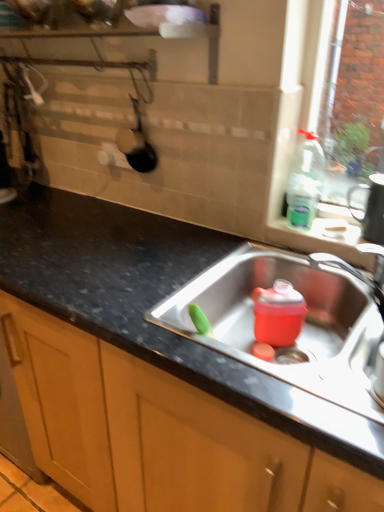
This screenshot has height=512, width=384. Describe the element at coordinates (302, 327) in the screenshot. I see `stainless steel sink at center` at that location.

Image resolution: width=384 pixels, height=512 pixels. Describe the element at coordinates (360, 272) in the screenshot. I see `metallic silver tap at right` at that location.

What do you see at coordinates (154, 304) in the screenshot? This screenshot has width=384, height=512. I see `black granite countertop at center` at bounding box center [154, 304].

The image size is (384, 512). What are the coordinates of `stainless steel sink at center` in the screenshot? It's located at (302, 327).

Considering the sizes of objects stainless steel sink at center and black granite countertop at center in the image provided, who is bigger, stainless steel sink at center or black granite countertop at center?

Bigger between the two is black granite countertop at center.

Considering the positions of points (308, 287) and (343, 441), is point (308, 287) farther from camera compared to point (343, 441)?

Yes, point (308, 287) is behind point (343, 441).

Measure the distance from stainless steel sink at center to black granite countertop at center.

They are 8.75 inches apart.

From a real-world perspective, is stainless steel sink at center positioned above or below black granite countertop at center?

In terms of real-world spatial position, stainless steel sink at center is above black granite countertop at center.

Looking at this image, considering the positions of objects black granite countertop at center and metallic silver tap at right in the image provided, who is more to the left, black granite countertop at center or metallic silver tap at right?

black granite countertop at center.

Could you tell me if black granite countertop at center is turned towards metallic silver tap at right?

No, black granite countertop at center is not aimed at metallic silver tap at right.

Considering the positions of points (124, 341) and (358, 276), is point (124, 341) farther from camera compared to point (358, 276)?

That is False.

Is black granite countertop at center in front of or behind metallic silver tap at right in the image?

black granite countertop at center is positioned closer to the viewer than metallic silver tap at right.

Is black granite countertop at center placed right next to black matte mug at upper right?

black granite countertop at center is not next to black matte mug at upper right, and they're not touching.

From a real-world perspective, is black granite countertop at center positioned under black matte mug at upper right based on gravity?

Yes, from a real-world perspective, black granite countertop at center is below black matte mug at upper right.

Visually, is black granite countertop at center positioned to the left or to the right of black matte mug at upper right?

black granite countertop at center is positioned on black matte mug at upper right's left side.

Looking at the image, does stainless steel sink at center seem bigger or smaller compared to black matte mug at upper right?

Clearly, stainless steel sink at center is larger in size than black matte mug at upper right.

Can you tell me how much stainless steel sink at center and black matte mug at upper right differ in facing direction?

They differ by 0.811 degrees in their facing directions.

Consider the image. Would you say stainless steel sink at center is a long distance from black matte mug at upper right?

They are positioned close to each other.

Which of these two, stainless steel sink at center or black matte mug at upper right, stands shorter?

With less height is stainless steel sink at center.

Looking at this image, does metallic silver tap at right have a lesser width compared to black matte mug at upper right?

Incorrect, the width of metallic silver tap at right is not less than that of black matte mug at upper right.

From the image's perspective, relative to black matte mug at upper right, is metallic silver tap at right above or below?

metallic silver tap at right is below black matte mug at upper right.

Which is behind, point (334, 261) or point (370, 209)?

Point (334, 261)

The height and width of the screenshot is (512, 384). Find the location of `tap on the right of stainless steel sink at center`. tap on the right of stainless steel sink at center is located at coordinates (360, 272).

Looking at this image, relative to stainless steel sink at center, is metallic silver tap at right in front or behind?

Clearly, metallic silver tap at right is behind stainless steel sink at center.

Does point (370, 253) appear closer or farther from the camera than point (353, 345)?

Point (370, 253).

Find the location of `countertop in front of the metallic silver tap at right`. countertop in front of the metallic silver tap at right is located at coordinates (154, 304).

From the picture: Does metallic silver tap at right contain black granite countertop at center?

No, black granite countertop at center is not a part of metallic silver tap at right.

What's the angular difference between metallic silver tap at right and black granite countertop at center's facing directions?

28.4 degrees separate the facing orientations of metallic silver tap at right and black granite countertop at center.

From a real-world perspective, is metallic silver tap at right positioned over black granite countertop at center based on gravity?

Correct, in the physical world, metallic silver tap at right is higher than black granite countertop at center.

Image resolution: width=384 pixels, height=512 pixels. I want to click on countertop in front of the stainless steel sink at center, so click(x=154, y=304).

Locate an element on the screen. Image resolution: width=384 pixels, height=512 pixels. tap above the black granite countertop at center (from the image's perspective) is located at coordinates (360, 272).

Which object lies nearer to the anchor point metallic silver tap at right, black matte mug at upper right or stainless steel sink at center?

black matte mug at upper right is positioned closer to the anchor metallic silver tap at right.

Looking at the image, which one is located further to black granite countertop at center, metallic silver tap at right or stainless steel sink at center?

metallic silver tap at right is further to black granite countertop at center.

Considering their positions, is metallic silver tap at right positioned further to black granite countertop at center than black matte mug at upper right?

Based on the image, black matte mug at upper right appears to be further to black granite countertop at center.

Considering their positions, is stainless steel sink at center positioned closer to black matte mug at upper right than black granite countertop at center?

stainless steel sink at center is positioned closer to the anchor black matte mug at upper right.

Estimate the real-world distances between objects in this image. Which object is further from stainless steel sink at center, black granite countertop at center or black matte mug at upper right?

black matte mug at upper right is further to stainless steel sink at center.

Which object lies further to the anchor point stainless steel sink at center, black granite countertop at center or metallic silver tap at right?

Among the two, black granite countertop at center is located further to stainless steel sink at center.

From the image, which object appears to be nearer to metallic silver tap at right, stainless steel sink at center or black matte mug at upper right?

black matte mug at upper right.

Based on their spatial positions, is black granite countertop at center or metallic silver tap at right closer to black matte mug at upper right?

metallic silver tap at right lies closer to black matte mug at upper right than the other object.

Where is `tap that lies between black matte mug at upper right and black granite countertop at center from top to bottom`? tap that lies between black matte mug at upper right and black granite countertop at center from top to bottom is located at coordinates (360, 272).

At what (x,y) coordinates should I click in order to perform the action: click on sink between metallic silver tap at right and black granite countertop at center in the up-down direction. Please return your answer as a coordinate pair (x, y). Image resolution: width=384 pixels, height=512 pixels. Looking at the image, I should click on (302, 327).

At what (x,y) coordinates should I click in order to perform the action: click on sink between black matte mug at upper right and black granite countertop at center vertically. Please return your answer as a coordinate pair (x, y). The width and height of the screenshot is (384, 512). Looking at the image, I should click on (302, 327).

Find the location of a particular element. Image resolution: width=384 pixels, height=512 pixels. tap between stainless steel sink at center and black matte mug at upper right from front to back is located at coordinates (360, 272).